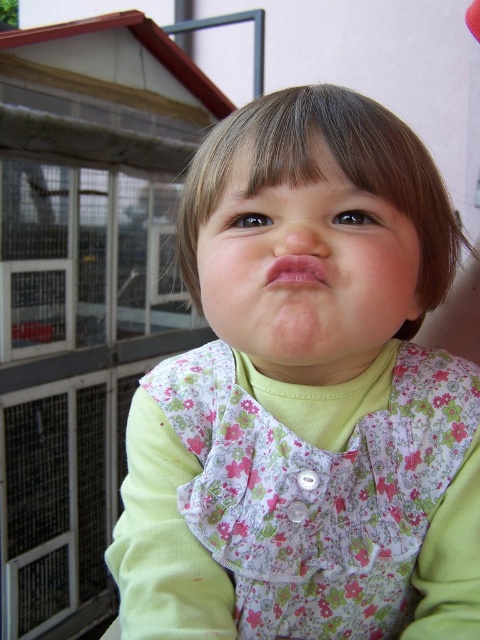
You are a photographer trying to capture the child in the image. You want to ensure that both the smooth skin face at center and the pink matte lips at center are clearly visible in your photo. Given their sizes, which of these two features might require you to adjust your camera focus more carefully to ensure clarity?

The smooth skin face at center has a greater height compared to the pink matte lips at center, so the photographer should focus more carefully on the smooth skin face at center to ensure clarity since it is larger in size.